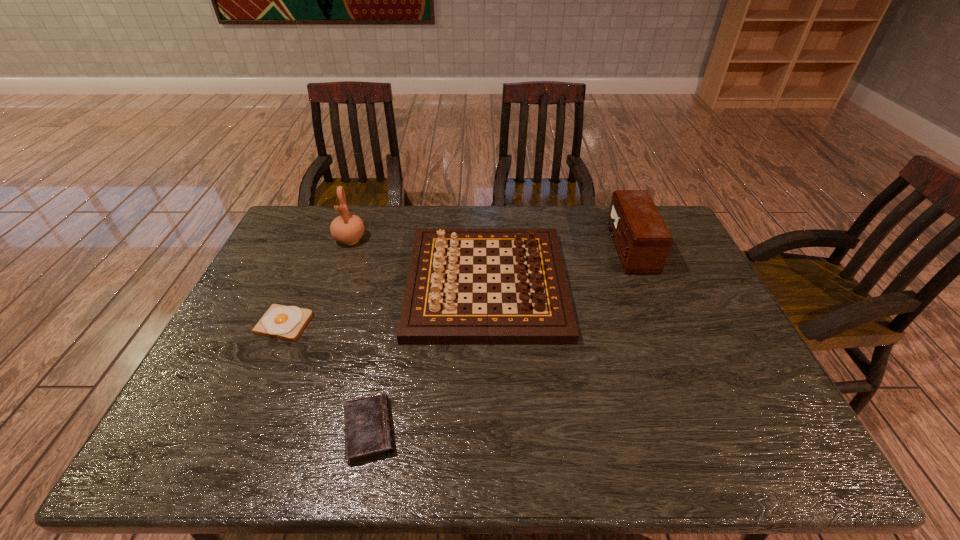
Where is `the tallest object`? the tallest object is located at coordinates (347, 228).

Find the location of a particular element. Image resolution: width=960 pixels, height=540 pixels. radio receiver is located at coordinates (642, 240).

The height and width of the screenshot is (540, 960). I want to click on the second tallest object, so click(x=642, y=240).

I want to click on gameboard, so click(432, 312).

Locate an element on the screen. The height and width of the screenshot is (540, 960). toast is located at coordinates (283, 322).

Identify the location of the nearest object. point(367,424).

The image size is (960, 540). In order to click on vacant space located 0.340m on the spout of the tallest object in this screenshot , I will do `click(320, 325)`.

Locate an element on the screen. This screenshot has height=540, width=960. vacant space located 0.220m on the front-facing side of the radio receiver is located at coordinates (545, 248).

This screenshot has width=960, height=540. In order to click on free spot located on the front-facing side of the radio receiver in this screenshot , I will do `click(501, 248)`.

In order to click on free space located on the front-facing side of the radio receiver in this screenshot , I will do `click(492, 248)`.